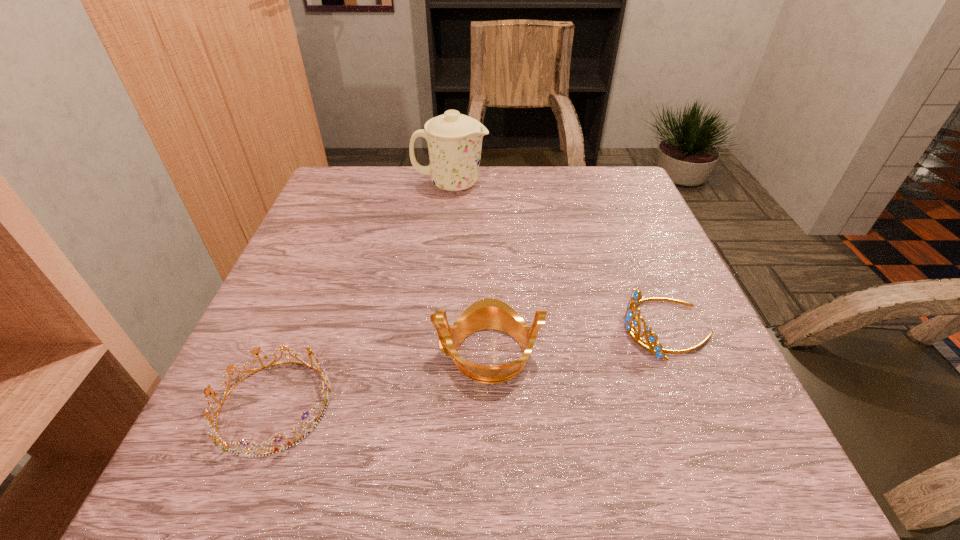
At what (x,y) coordinates should I click in order to perform the action: click on free location at the left edge. Please return your answer as a coordinate pair (x, y). This screenshot has height=540, width=960. Looking at the image, I should click on (314, 231).

Identify the location of vacant space at the right edge. (630, 215).

In the image, there is a desktop. Where is `vacant space at the far left corner`? The width and height of the screenshot is (960, 540). vacant space at the far left corner is located at coordinates (324, 191).

This screenshot has height=540, width=960. In the image, there is a desktop. What are the coordinates of `vacant region at the near left corner` in the screenshot? It's located at (248, 489).

This screenshot has width=960, height=540. I want to click on vacant position at the near right corner of the desktop, so click(664, 451).

Locate an element on the screen. The width and height of the screenshot is (960, 540). unoccupied position between the second tiara from left to right and the leftmost object is located at coordinates (381, 379).

I want to click on vacant area between the rightmost tiara and the second tiara from right to left, so tap(577, 341).

Locate an element on the screen. This screenshot has height=540, width=960. free space between the leftmost tiara and the farthest object is located at coordinates (363, 295).

Image resolution: width=960 pixels, height=540 pixels. Identify the location of free spot between the farthest object and the shortest tiara. (363, 295).

At what (x,y) coordinates should I click in order to perform the action: click on vacant point located between the rightmost object and the second tiara from left to right. Please return your answer as a coordinate pair (x, y). This screenshot has width=960, height=540. Looking at the image, I should click on (577, 341).